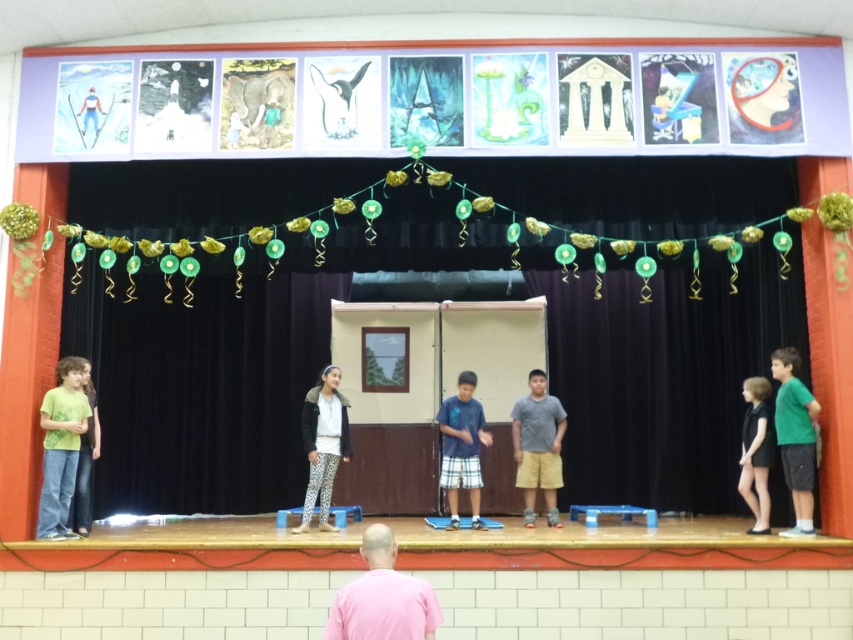
You are a photographer taking a picture of the stage setup. You notice the green matte shirt at left and the black dress at right. Which clothing item should you focus on if you want to capture the smaller one in the image?

The green matte shirt at left is smaller than the black dress at right, so you should focus on the green matte shirt at left to capture the smaller one.

You are a stagehand who needs to place a 1.2 meter tall decoration on either the wooden stage at center or the smooth wood board at lower center. Based on their heights, which surface can safely support the decoration without it toppling over?

The wooden stage at center has a greater height compared to the smooth wood board at lower center, so placing the 1.2 meter tall decoration on the wooden stage at center would be safer as its height provides a more stable base to prevent toppling.

You are a photographer standing in the gymnasium and want to capture a photo of the green matte shirt at left. Where should you position yourself to ensure the subject is centered in your camera viewfinder?

To center the green matte shirt at left in your camera viewfinder, position yourself directly in front of the green matte shirt at left, aligning your camera with its coordinates at point [61,445].